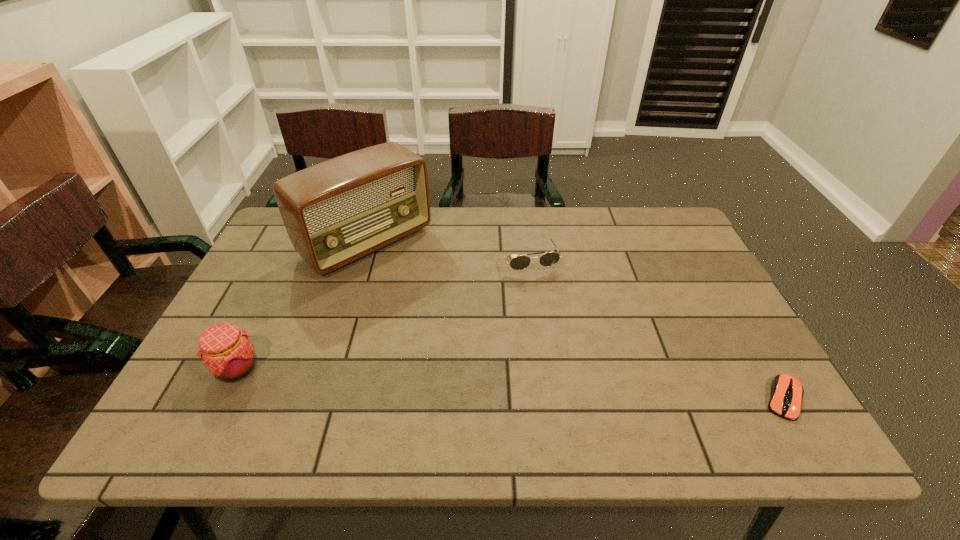
Identify the location of object present at the right edge. This screenshot has height=540, width=960. (787, 392).

The image size is (960, 540). Identify the location of object at the far left corner. (335, 212).

I want to click on object positioned at the near left corner, so click(x=227, y=352).

The width and height of the screenshot is (960, 540). Identify the location of object at the near right corner. (787, 392).

This screenshot has height=540, width=960. I want to click on free space at the far edge of the desktop, so click(426, 241).

You are a GUI agent. You are given a task and a screenshot of the screen. Output one action in this format:
    pyautogui.click(x=<x>, y=<y>)
    Task: Click on the free space at the near edge
    This screenshot has height=540, width=960.
    Given the screenshot: What is the action you would take?
    pyautogui.click(x=374, y=395)

I want to click on free space at the left edge of the desktop, so click(258, 266).

Where is `vacant space at the right edge`? The height and width of the screenshot is (540, 960). vacant space at the right edge is located at coordinates (684, 316).

I want to click on free space at the far right corner of the desktop, so click(636, 208).

Where is `vacant space that's between the tallest object and the shortest object`? The image size is (960, 540). vacant space that's between the tallest object and the shortest object is located at coordinates (575, 321).